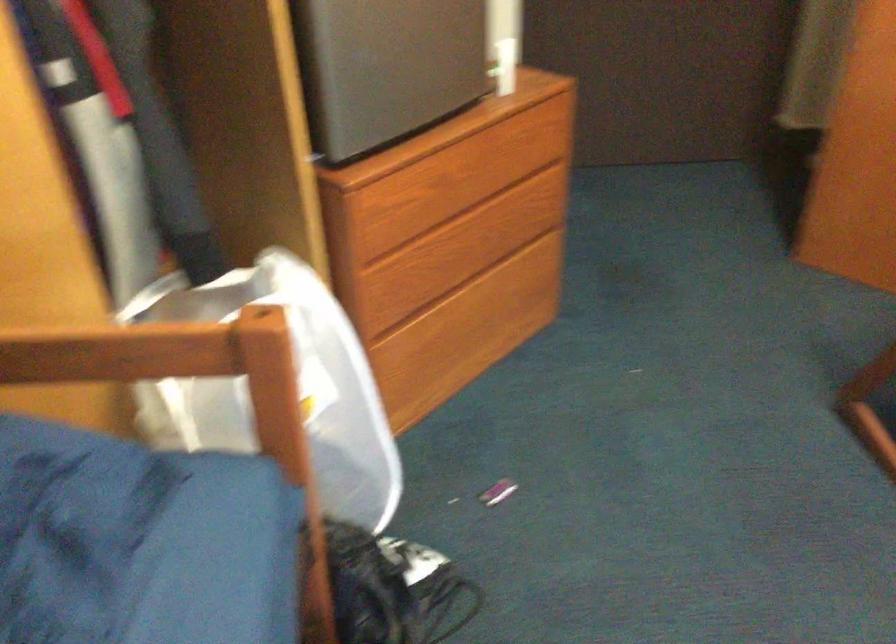
In order to click on small purple object in this screenshot , I will do `click(497, 491)`.